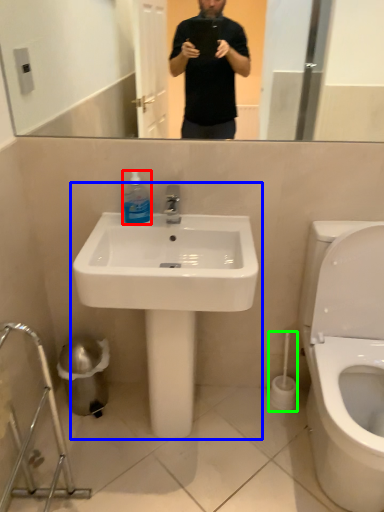
Question: Estimate the real-world distances between objects in this image. Which object is closer to cleaning product (highlighted by a red box), sink (highlighted by a blue box) or brush (highlighted by a green box)?

Choices:
 (A) sink
 (B) brush

Answer: (A)